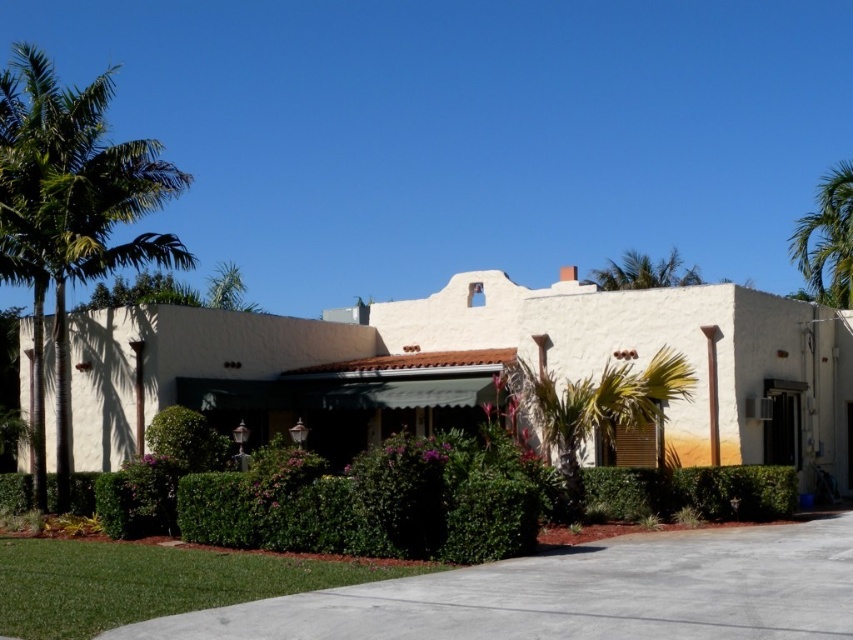
Can you confirm if green leafy palm tree at left is shorter than green leafy palm tree at upper center?

Incorrect, green leafy palm tree at left's height does not fall short of green leafy palm tree at upper center's.

What do you see at coordinates (70, 212) in the screenshot? This screenshot has width=853, height=640. I see `green leafy palm tree at left` at bounding box center [70, 212].

Identify the location of green leafy palm tree at left. This screenshot has width=853, height=640. (70, 212).

Can you confirm if gray concrete driveway at lower center is positioned above green leafy bush at center?

No, gray concrete driveway at lower center is not above green leafy bush at center.

Is point (207, 618) closer to viewer compared to point (209, 424)?

Yes, point (207, 618) is in front of point (209, 424).

Where is `gray concrete driveway at lower center`? gray concrete driveway at lower center is located at coordinates (577, 595).

Does green leafy bush at center come behind green leafy palm tree at upper center?

That is False.

Can you confirm if green leafy bush at center is positioned to the right of green leafy palm tree at upper center?

No, green leafy bush at center is not to the right of green leafy palm tree at upper center.

Is point (178, 436) positioned after point (630, 268)?

No, it is in front of (630, 268).

Identify the location of green leafy bush at center. (187, 440).